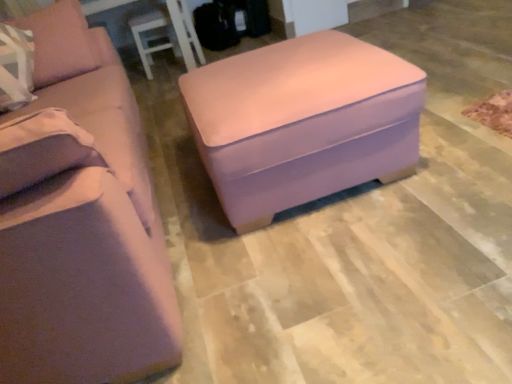
Locate an element on the screen. matte pink ottoman at center is located at coordinates (302, 121).

The image size is (512, 384). Describe the element at coordinates (82, 223) in the screenshot. I see `matte pink fabric studio couch at center` at that location.

This screenshot has height=384, width=512. In order to click on matte pink fabric studio couch at center in this screenshot , I will do `click(82, 223)`.

Locate an element on the screen. matte pink ottoman at center is located at coordinates (302, 121).

Looking at this image, between matte pink fabric studio couch at center and suede-like beige pillow at left, which one is positioned behind?

suede-like beige pillow at left is further away from the camera.

Does point (15, 115) come in front of point (73, 38)?

Yes, point (15, 115) is in front of point (73, 38).

Would you say matte pink fabric studio couch at center is inside or outside suede-like beige pillow at left?

matte pink fabric studio couch at center exists outside the volume of suede-like beige pillow at left.

How different are the orientations of matte pink ottoman at center and matte pink fabric studio couch at center in degrees?

The angular difference between matte pink ottoman at center and matte pink fabric studio couch at center is 0.00114 degrees.

Do you think matte pink ottoman at center is within matte pink fabric studio couch at center, or outside of it?

The correct answer is: outside.

Which is closer to the camera, [231,88] or [40,124]?

The point [40,124] is closer to the camera.

From their relative heights in the image, would you say matte pink ottoman at center is taller or shorter than matte pink fabric studio couch at center?

In the image, matte pink ottoman at center appears to be shorter than matte pink fabric studio couch at center.

Considering the sizes of objects suede-like beige pillow at left and matte pink ottoman at center in the image provided, who is taller, suede-like beige pillow at left or matte pink ottoman at center?

Standing taller between the two is suede-like beige pillow at left.

From the image's perspective, who appears lower, suede-like beige pillow at left or matte pink ottoman at center?

From the image's view, matte pink ottoman at center is below.

From a real-world perspective, is suede-like beige pillow at left on top of matte pink ottoman at center?

Correct, in the physical world, suede-like beige pillow at left is higher than matte pink ottoman at center.

Is matte pink fabric studio couch at center not close to matte pink ottoman at center?

No, matte pink fabric studio couch at center is not far from matte pink ottoman at center.

Considering the positions of objects matte pink fabric studio couch at center and matte pink ottoman at center in the image provided, who is more to the right, matte pink fabric studio couch at center or matte pink ottoman at center?

matte pink ottoman at center is more to the right.

From a real-world perspective, which is physically below, matte pink fabric studio couch at center or matte pink ottoman at center?

matte pink ottoman at center.

Does point (128, 104) come behind point (285, 115)?

Yes, it is.

Would you say suede-like beige pillow at left is inside or outside matte pink fabric studio couch at center?

suede-like beige pillow at left is enclosed within matte pink fabric studio couch at center.

Is suede-like beige pillow at left far from matte pink fabric studio couch at center?

Actually, suede-like beige pillow at left and matte pink fabric studio couch at center are a little close together.

From the image's perspective, would you say suede-like beige pillow at left is shown under matte pink fabric studio couch at center?

No.

Is matte pink ottoman at center not near suede-like beige pillow at left?

Indeed, matte pink ottoman at center is not near suede-like beige pillow at left.

Between matte pink ottoman at center and suede-like beige pillow at left, which one has smaller size?

Smaller between the two is suede-like beige pillow at left.

Is point (292, 101) less distant than point (61, 29)?

Yes, point (292, 101) is closer to viewer.

Is matte pink ottoman at center positioned before suede-like beige pillow at left?

That is True.

The width and height of the screenshot is (512, 384). Find the location of `studio couch lying on the right of suede-like beige pillow at left`. studio couch lying on the right of suede-like beige pillow at left is located at coordinates (82, 223).

Locate an element on the screen. The width and height of the screenshot is (512, 384). studio couch on the left of matte pink ottoman at center is located at coordinates (82, 223).

Which object lies further to the anchor point matte pink fabric studio couch at center, suede-like beige pillow at left or matte pink ottoman at center?

Based on the image, matte pink ottoman at center appears to be further to matte pink fabric studio couch at center.

Looking at the image, which one is located further to matte pink fabric studio couch at center, matte pink ottoman at center or suede-like beige pillow at left?

matte pink ottoman at center lies further to matte pink fabric studio couch at center than the other object.

In the scene shown: From the image, which object appears to be nearer to matte pink ottoman at center, matte pink fabric studio couch at center or suede-like beige pillow at left?

matte pink fabric studio couch at center is positioned closer to the anchor matte pink ottoman at center.

Estimate the real-world distances between objects in this image. Which object is further from suede-like beige pillow at left, matte pink fabric studio couch at center or matte pink ottoman at center?

Among the two, matte pink ottoman at center is located further to suede-like beige pillow at left.

Which object lies further to the anchor point suede-like beige pillow at left, matte pink ottoman at center or matte pink fabric studio couch at center?

matte pink ottoman at center.

Considering their positions, is suede-like beige pillow at left positioned closer to matte pink ottoman at center than matte pink fabric studio couch at center?

The object closer to matte pink ottoman at center is matte pink fabric studio couch at center.

Where is `studio couch between suede-like beige pillow at left and matte pink ottoman at center`? This screenshot has height=384, width=512. studio couch between suede-like beige pillow at left and matte pink ottoman at center is located at coordinates (82, 223).